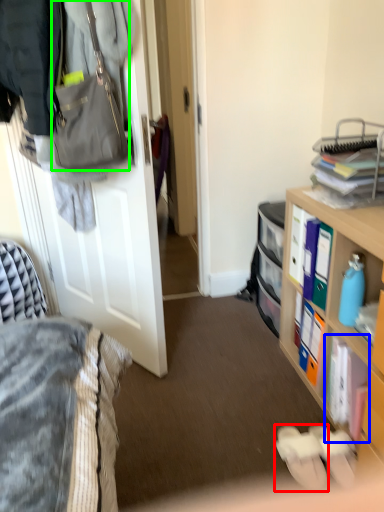
Question: Considering the real-world distances, which object is closest to footwear (highlighted by a red box)? book (highlighted by a blue box) or handbag (highlighted by a green box).

Choices:
 (A) book
 (B) handbag

Answer: (A)